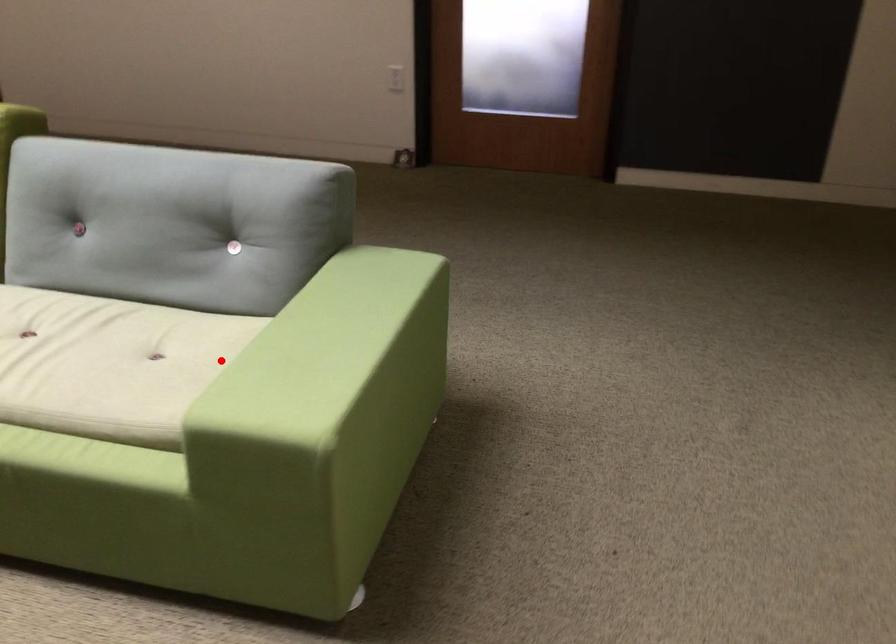
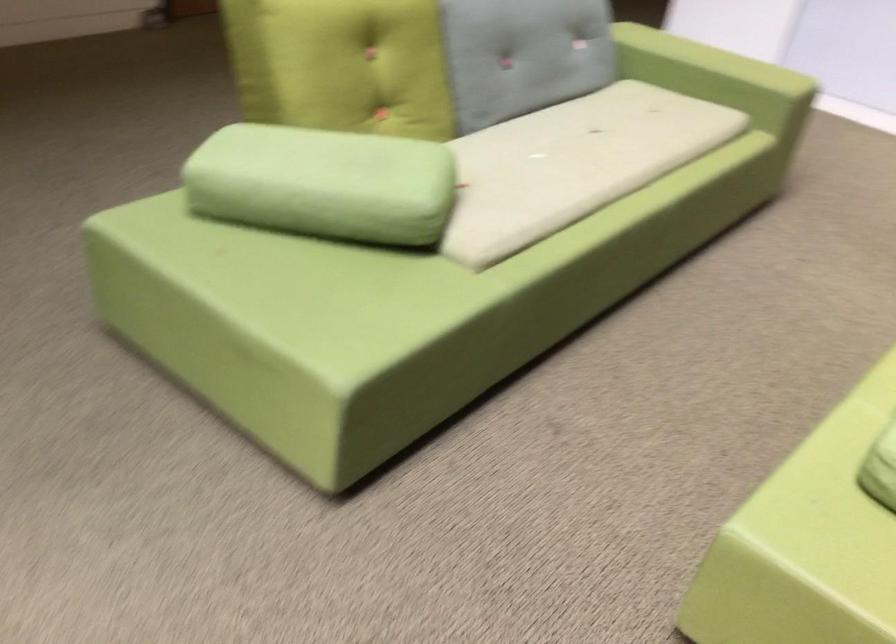
Find the pixel in the second image that matches the highlighted location in the first image.

(717, 77)